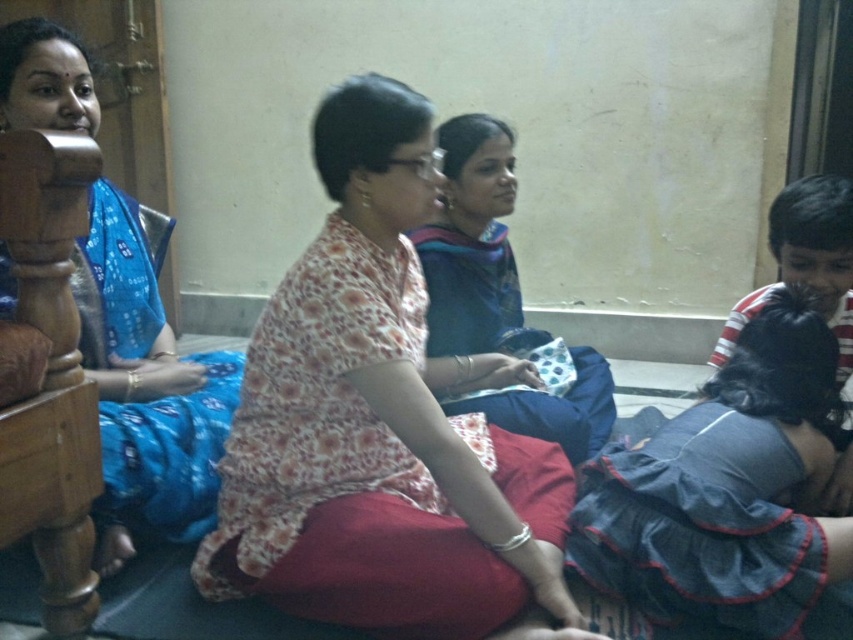
Question: Which point is closer to the camera?

Choices:
 (A) (428, 129)
 (B) (439, 282)
 (C) (741, 301)

Answer: (A)

Question: Does dark blue satin sari at lower right have a smaller size compared to blue printed saree at left?

Choices:
 (A) yes
 (B) no

Answer: (A)

Question: Which object is closer to the camera taking this photo?

Choices:
 (A) floral fabric blouse at center
 (B) blue fabric saree at center
 (C) striped cotton shirt at right
 (D) dark blue satin sari at lower right

Answer: (A)

Question: Is dark blue satin sari at lower right bigger than striped cotton shirt at right?

Choices:
 (A) no
 (B) yes

Answer: (B)

Question: Is floral fabric blouse at center to the right of dark blue satin sari at lower right from the viewer's perspective?

Choices:
 (A) no
 (B) yes

Answer: (A)

Question: Which of the following is the farthest from the observer?

Choices:
 (A) (289, 474)
 (B) (592, 486)
 (C) (834, 337)
 (D) (463, 300)

Answer: (D)